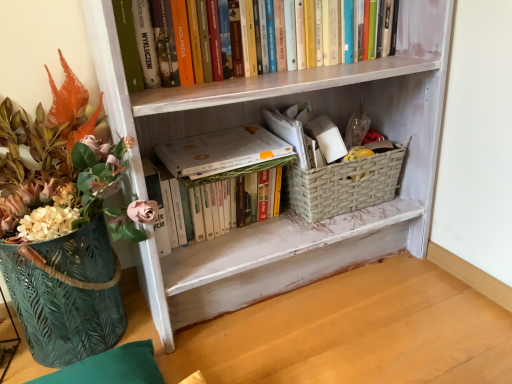
Question: Would you consider woven beige basket at lower center to be distant from white painted wood bookcase at center?

Choices:
 (A) yes
 (B) no

Answer: (B)

Question: Is woven beige basket at lower center smaller than white painted wood bookcase at center?

Choices:
 (A) no
 (B) yes

Answer: (B)

Question: Is woven beige basket at lower center thinner than white painted wood bookcase at center?

Choices:
 (A) no
 (B) yes

Answer: (B)

Question: Could white painted wood bookcase at center be considered to be inside woven beige basket at lower center?

Choices:
 (A) no
 (B) yes

Answer: (A)

Question: From a real-world perspective, is woven beige basket at lower center positioned over white painted wood bookcase at center based on gravity?

Choices:
 (A) yes
 (B) no

Answer: (B)

Question: Does point 385,130 appear closer or farther from the camera than point 240,130?

Choices:
 (A) closer
 (B) farther

Answer: (B)

Question: From a real-world perspective, is white painted wood bookcase at center positioned above or below white matte book at center?

Choices:
 (A) below
 (B) above

Answer: (B)

Question: From the image's perspective, is white painted wood bookcase at center above or below white matte book at center?

Choices:
 (A) above
 (B) below

Answer: (A)

Question: Visually, is white painted wood bookcase at center positioned to the left or to the right of white matte book at center?

Choices:
 (A) right
 (B) left

Answer: (A)

Question: Looking at their shapes, would you say hardcover books at upper center, the 2th book positioned from the bottom, is wider or thinner than white matte book at center?

Choices:
 (A) thin
 (B) wide

Answer: (A)

Question: Based on their positions, is hardcover books at upper center, the 2th book positioned from the bottom, located to the left or right of white matte book at center?

Choices:
 (A) right
 (B) left

Answer: (A)

Question: Is hardcover books at upper center, which ranks as the first book in top-to-bottom order, taller or shorter than white matte book at center?

Choices:
 (A) tall
 (B) short

Answer: (A)

Question: From a real-world perspective, relative to white matte book at center, is hardcover books at upper center, which ranks as the first book in top-to-bottom order, vertically above or below?

Choices:
 (A) below
 (B) above

Answer: (B)

Question: Is woven beige basket at lower center bigger or smaller than white matte book at center?

Choices:
 (A) small
 (B) big

Answer: (B)

Question: From a real-world perspective, is woven beige basket at lower center physically located above or below white matte book at center?

Choices:
 (A) above
 (B) below

Answer: (B)